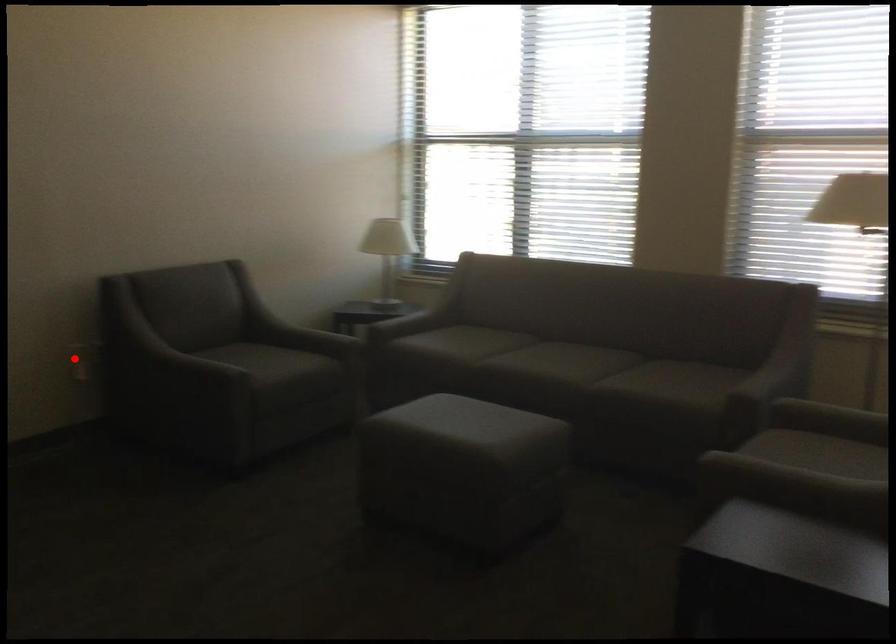
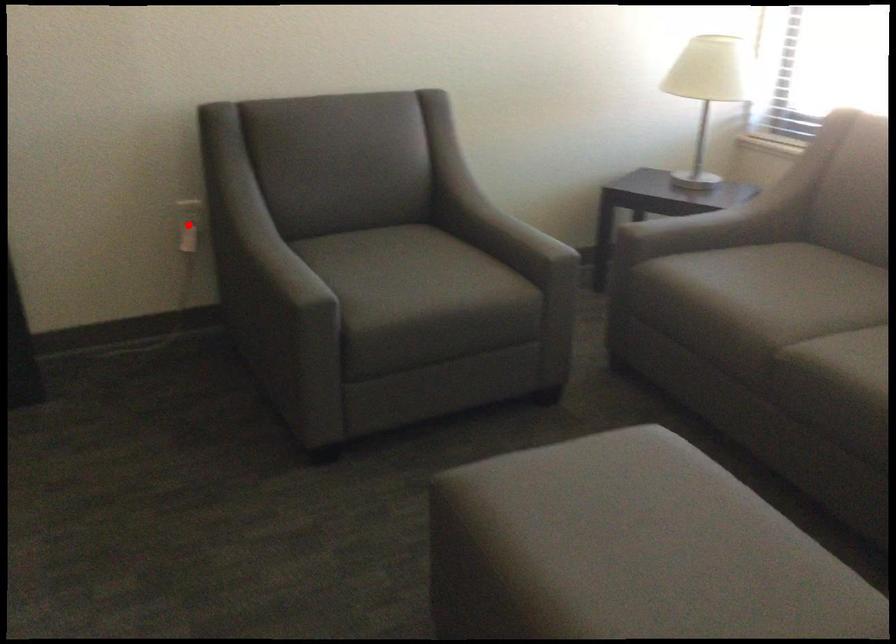
I am providing you with two images of the same scene from different viewpoints. A red point is marked on the first image and another point is marked on the second image. Are the points marked in image1 and image2 representing the same 3D position?

Yes